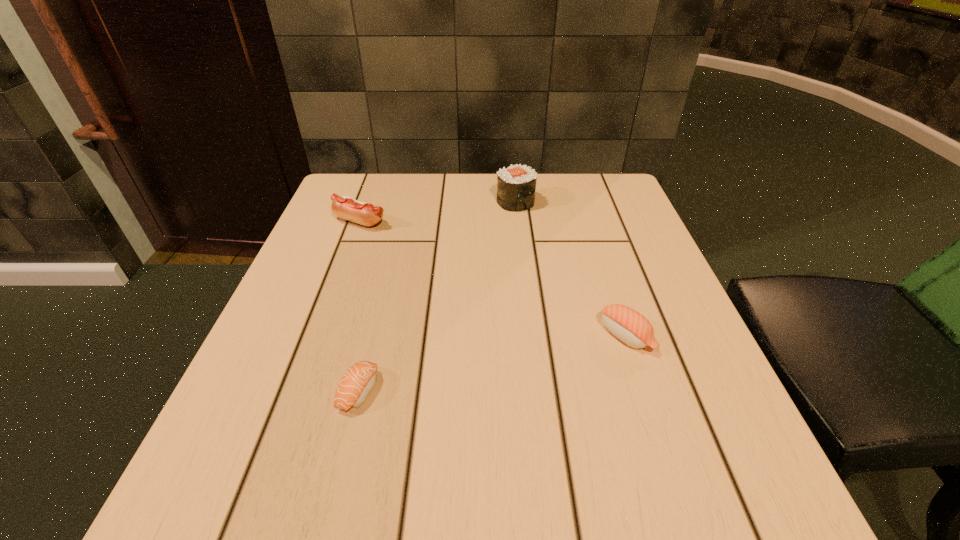
In order to click on free space between the leftmost object and the rightmost sushi in this screenshot , I will do `click(493, 279)`.

At what (x,y) coordinates should I click in order to perform the action: click on free spot between the shortest sushi and the leftmost object. Please return your answer as a coordinate pair (x, y). Image resolution: width=960 pixels, height=540 pixels. Looking at the image, I should click on (360, 306).

Where is `object that is the nearest to the sausage`? The width and height of the screenshot is (960, 540). object that is the nearest to the sausage is located at coordinates (516, 185).

Identify the location of object that stands as the second closest to the leftmost object. The image size is (960, 540). (358, 381).

Find the location of `sushi that stands as the closest to the second nearest object`. sushi that stands as the closest to the second nearest object is located at coordinates (516, 185).

Locate which sushi is the closest to the nearest object. Please provide its 2D coordinates. Your answer should be formatted as a tuple, i.e. [(x, y)], where the tuple contains the x and y coordinates of a point satisfying the conditions above.

[(628, 325)]

In order to click on vacant position in the image that satisfies the following two spatial constraints: 1. on the front side of the sausage; 2. on the right side of the third farthest object in this screenshot , I will do `click(319, 336)`.

This screenshot has height=540, width=960. What are the coordinates of `vacant space that satisfies the following two spatial constraints: 1. on the back side of the second nearest object; 2. on the right side of the nearest sushi` in the screenshot? It's located at (372, 336).

This screenshot has height=540, width=960. Identify the location of vacant space that satisfies the following two spatial constraints: 1. on the front side of the second nearest object; 2. on the left side of the tallest sushi. (531, 336).